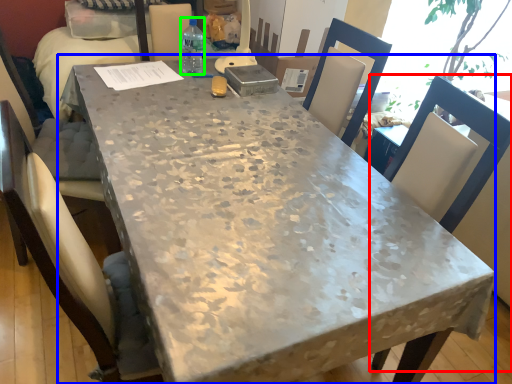
Question: Which object is positioned farthest from chair (highlighted by a red box)? Select from table (highlighted by a blue box) and bottle (highlighted by a green box).

Choices:
 (A) table
 (B) bottle

Answer: (B)